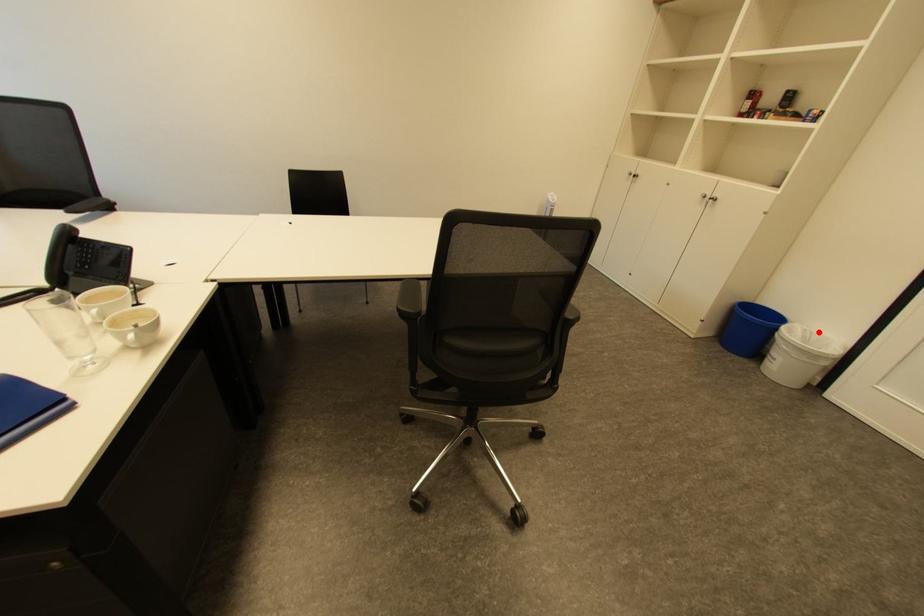
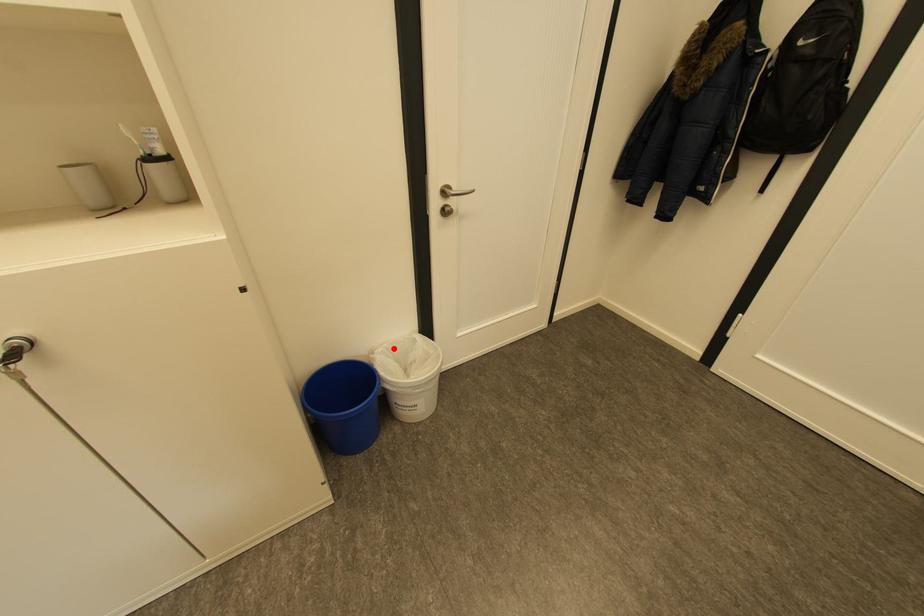
I am providing you with two images of the same scene from different viewpoints. A red point is marked on the first image and another point is marked on the second image. Does the point marked in image1 correspond to the same location as the one in image2?

Yes